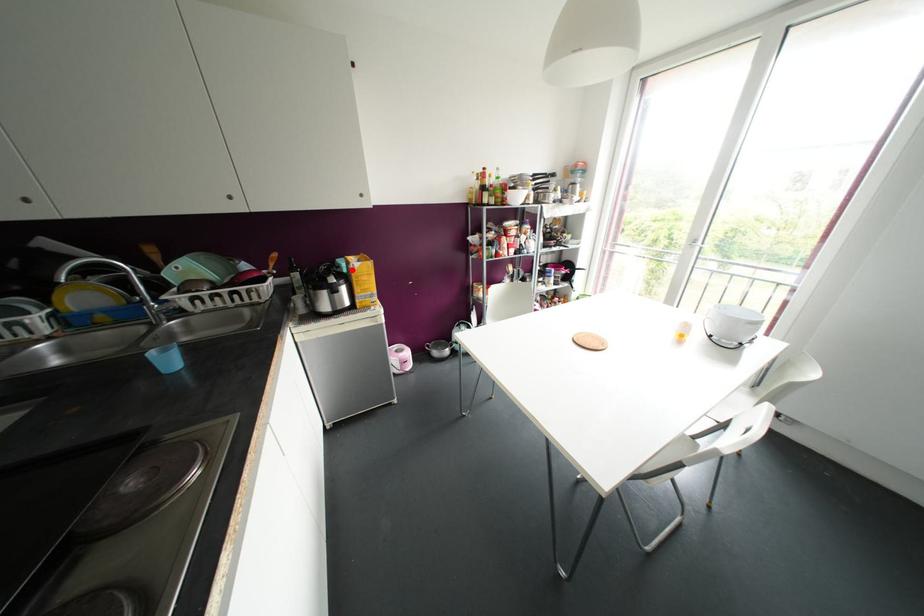
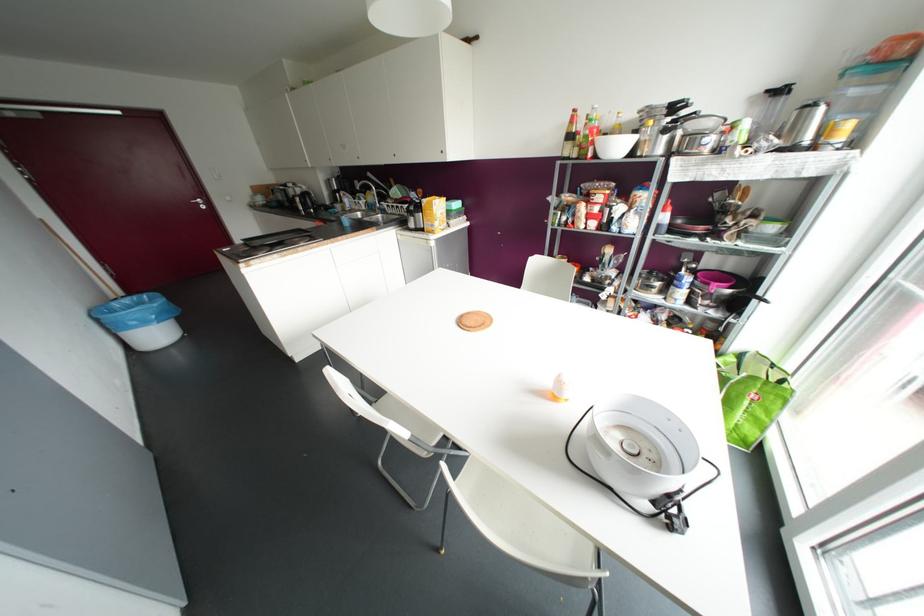
Find the pixel in the second image that matches the highlighted location in the first image.

(421, 204)